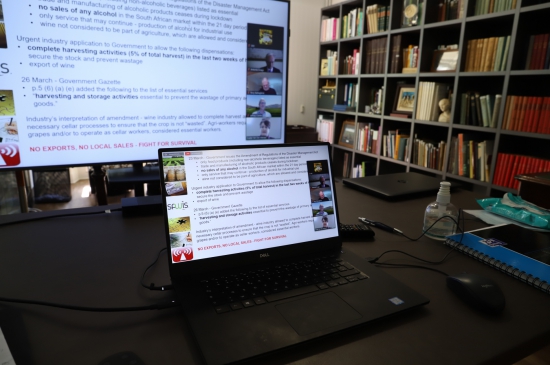
You are a GUI agent. You are given a task and a screenshot of the screen. Output one action in this format:
    pyautogui.click(x=<x>, y=<y>)
    Task: Click on the television screen
    The image size is (550, 365).
    Given the screenshot: What is the action you would take?
    pyautogui.click(x=148, y=72)